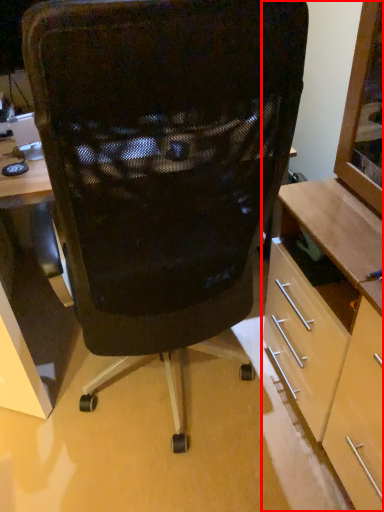
Question: From the image, what is the correct spatial relationship of cabinetry (annotated by the red box) in relation to chair?

Choices:
 (A) right
 (B) left

Answer: (A)